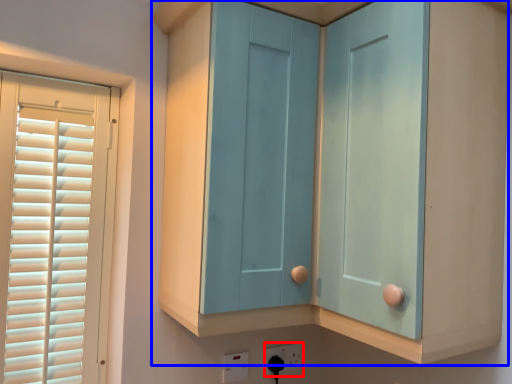
Question: Which of the following is the farthest to the observer, electric outlet (highlighted by a red box) or cupboard (highlighted by a blue box)?

Choices:
 (A) electric outlet
 (B) cupboard

Answer: (A)